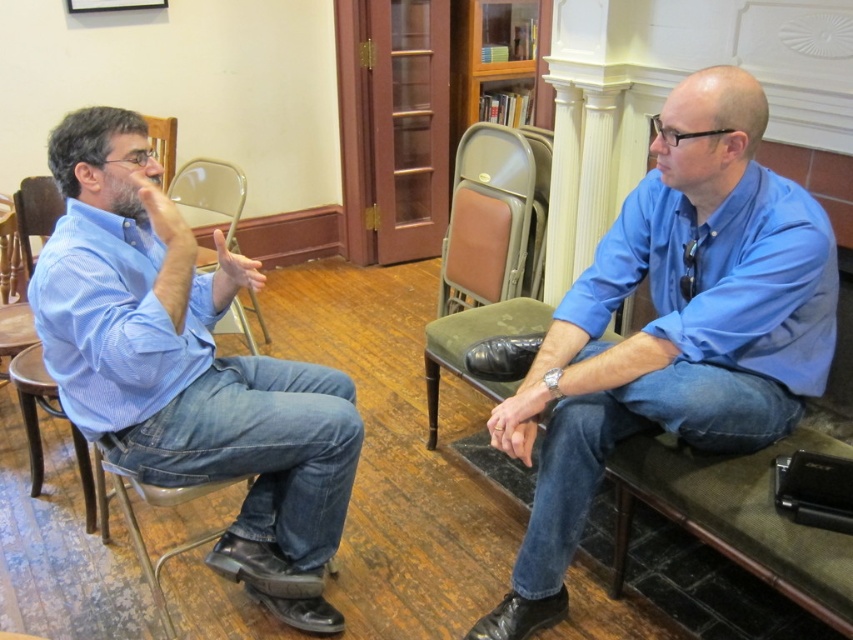
Question: Is blue striped shirt at left further to camera compared to transparent plastic chair at center?

Choices:
 (A) yes
 (B) no

Answer: (B)

Question: Is blue striped shirt at left smaller than tan leather chair at center?

Choices:
 (A) yes
 (B) no

Answer: (B)

Question: Which point is farther to the camera?

Choices:
 (A) blue striped shirt at left
 (B) blue cotton shirt at right
 (C) transparent plastic chair at center
 (D) tan leather chair at center

Answer: (C)

Question: Which object is positioned farthest from the blue striped shirt at left?

Choices:
 (A) transparent plastic chair at center
 (B) tan leather chair at center

Answer: (B)

Question: In this image, where is tan leather chair at center located relative to transparent plastic chair at center?

Choices:
 (A) right
 (B) left

Answer: (A)

Question: Which of these objects is positioned farthest from the transparent plastic chair at center?

Choices:
 (A) blue cotton shirt at right
 (B) blue striped shirt at left

Answer: (A)